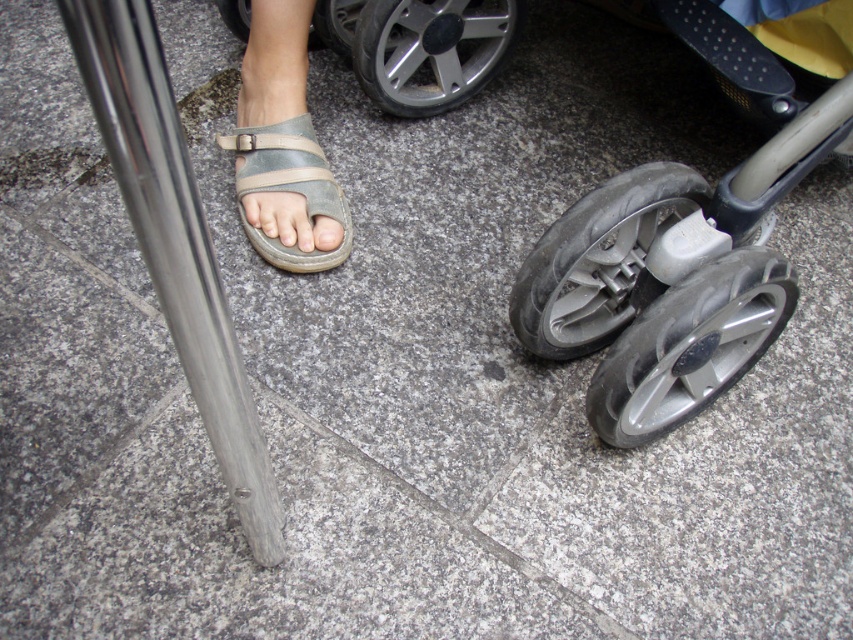
Question: Is polished metal pole at left smaller than metallic gray tire at center?

Choices:
 (A) yes
 (B) no

Answer: (B)

Question: Is the position of leather sandal at center more distant than that of gray matte toe at center?

Choices:
 (A) no
 (B) yes

Answer: (B)

Question: Is leather sandal at center to the right of matte gray sandal at center from the viewer's perspective?

Choices:
 (A) no
 (B) yes

Answer: (B)

Question: Which object appears closest to the camera in this image?

Choices:
 (A) black rubber wheel at lower right
 (B) metallic gray tire at center

Answer: (A)

Question: Among these objects, which one is farthest from the camera?

Choices:
 (A) rubber/plastic wheel at lower right
 (B) leather sandal at center
 (C) rubber/smooth tire at center
 (D) gray matte toe at center

Answer: (C)

Question: Considering the real-world distances, which object is farthest from the leather sandal at center?

Choices:
 (A) silver metallic wheel at center
 (B) gray matte toe at center
 (C) black rubber wheel at lower right
 (D) polished metal pole at left

Answer: (D)